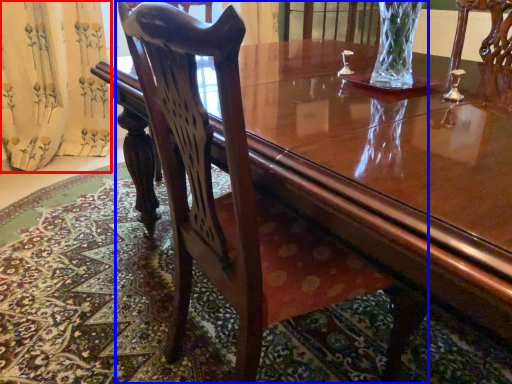
Question: Which of the following is the farthest to the observer, curtain (highlighted by a red box) or chair (highlighted by a blue box)?

Choices:
 (A) curtain
 (B) chair

Answer: (A)